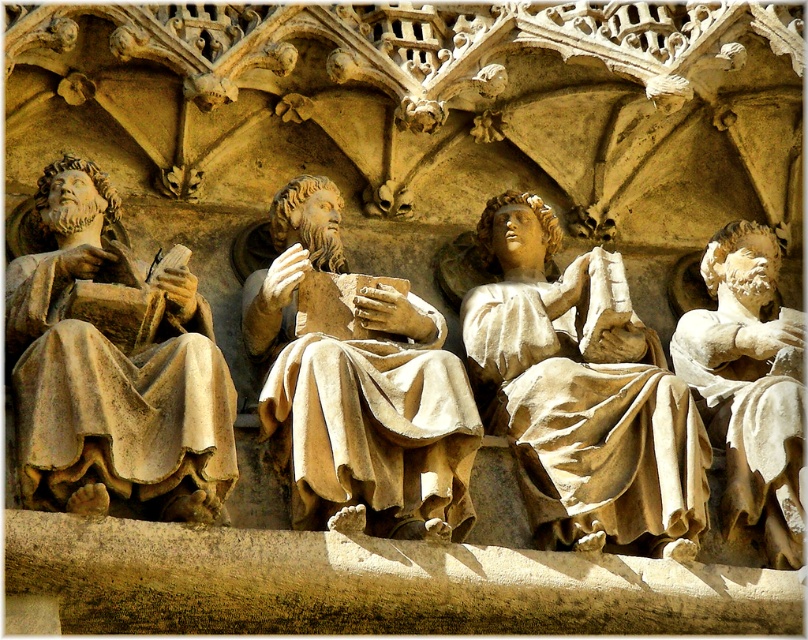
Question: Is beige stone statue at left to the left of beige stone statue at center from the viewer's perspective?

Choices:
 (A) yes
 (B) no

Answer: (A)

Question: Can you confirm if beige stone statue at left is positioned above beige stone statue at right?

Choices:
 (A) yes
 (B) no

Answer: (A)

Question: In this image, where is beige stone statue at left located relative to beige stone statue at right?

Choices:
 (A) right
 (B) left

Answer: (B)

Question: Which point appears closest to the camera in this image?

Choices:
 (A) (554, 310)
 (B) (76, 240)
 (C) (790, 516)
 (D) (318, 464)

Answer: (D)

Question: Among these objects, which one is nearest to the camera?

Choices:
 (A) beige stone statue at center
 (B) matte stone statue at center

Answer: (A)

Question: Which point is farther from the camera taking this photo?

Choices:
 (A) (53, 182)
 (B) (781, 419)
 (C) (607, 436)
 (D) (474, 404)

Answer: (A)